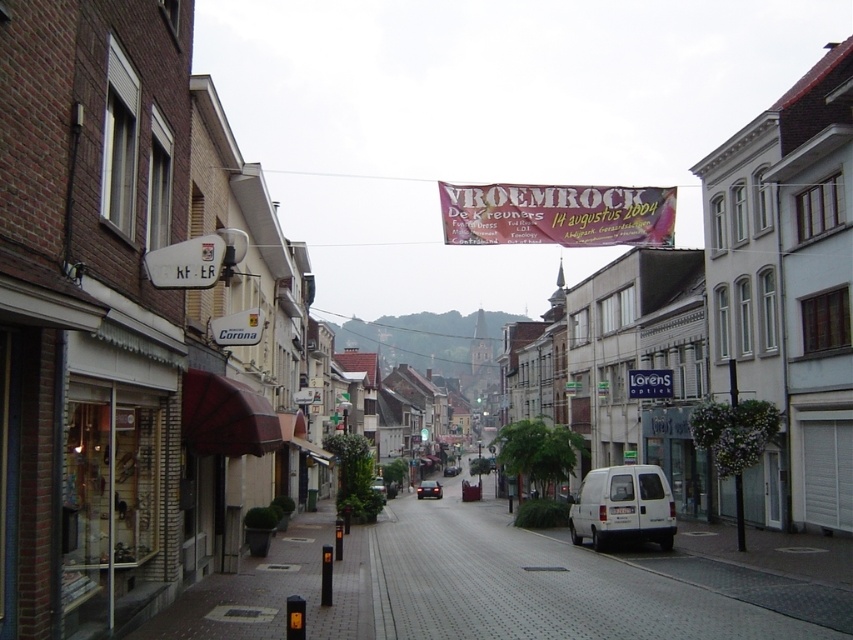
You are a tourist standing on the street and want to take a photo of both the vivid pink fabric banner at center and the shiny black car at center. Which object should you focus on first to ensure both are in the frame?

You should focus on the vivid pink fabric banner at center first because it is closer to you than the shiny black car at center, so adjusting the camera to include the closer banner will also capture the car further back.

Looking at this image, you are a delivery driver who needs to park your white matte van at center in a spot that is behind the white plastic sign at center. Is this possible given the current arrangement?

The white matte van at center is currently in front of the white plastic sign at center, so you cannot park it behind the sign as it is already blocking it.